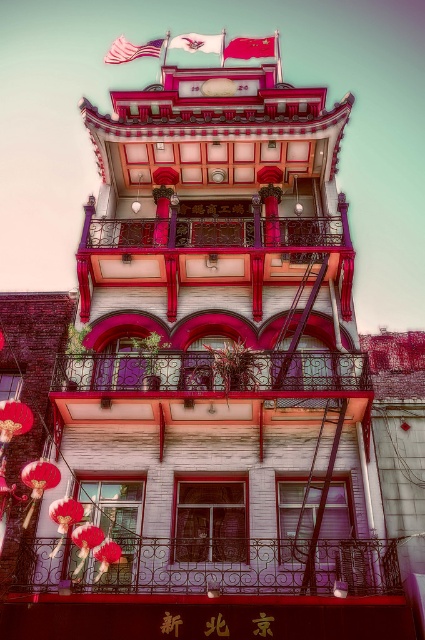
Question: Is metallic wrought iron balcony at lower center further to the viewer compared to rustic wrought iron balcony at center?

Choices:
 (A) yes
 (B) no

Answer: (B)

Question: Is rustic wrought iron balcony at center further to camera compared to american flag at upper left?

Choices:
 (A) yes
 (B) no

Answer: (B)

Question: Which object is the closest to the american flag at upper left?

Choices:
 (A) metallic wrought iron balcony at center
 (B) red fabric flag at upper center
 (C) silky fabric flag at upper center
 (D) metallic wrought iron balcony at lower center

Answer: (C)

Question: Which of the following is the closest to the observer?

Choices:
 (A) metallic wrought iron balcony at lower center
 (B) rustic wrought iron balcony at center
 (C) metallic wrought iron balcony at center

Answer: (A)

Question: Among these objects, which one is farthest from the camera?

Choices:
 (A) rustic wrought iron balcony at center
 (B) metallic wrought iron balcony at center

Answer: (B)

Question: Is rustic wrought iron balcony at center above american flag at upper left?

Choices:
 (A) yes
 (B) no

Answer: (B)